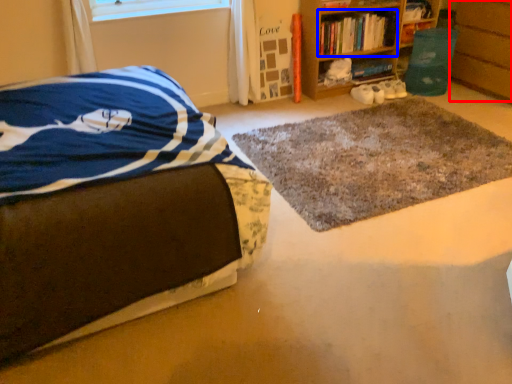
Question: Among these objects, which one is farthest to the camera, cabinetry (highlighted by a red box) or book (highlighted by a blue box)?

Choices:
 (A) cabinetry
 (B) book

Answer: (B)